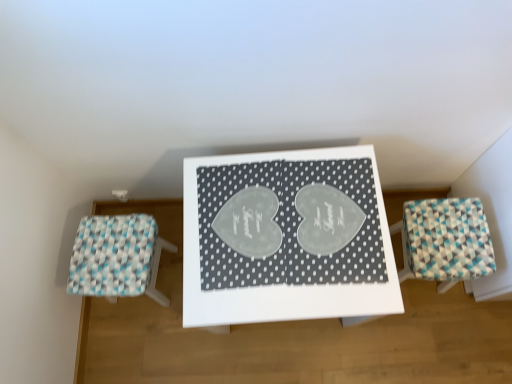
The image size is (512, 384). I want to click on free space in front of white glossy table at center, so click(x=298, y=357).